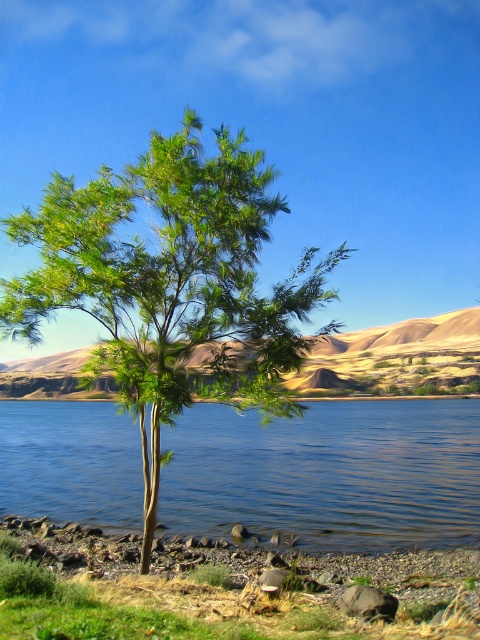
Question: Is green leafy tree at center wider than blue liquid water at center?

Choices:
 (A) no
 (B) yes

Answer: (A)

Question: Does green leafy tree at center appear on the right side of blue liquid water at center?

Choices:
 (A) no
 (B) yes

Answer: (A)

Question: Among these points, which one is nearest to the camera?

Choices:
 (A) (230, 243)
 (B) (411, 467)

Answer: (A)

Question: Which point is closer to the camera?

Choices:
 (A) green leafy tree at center
 (B) blue liquid water at center

Answer: (A)

Question: Which point is closer to the camera?

Choices:
 (A) (57, 438)
 (B) (165, 317)

Answer: (B)

Question: Can you confirm if green leafy tree at center is positioned to the left of blue liquid water at center?

Choices:
 (A) yes
 (B) no

Answer: (A)